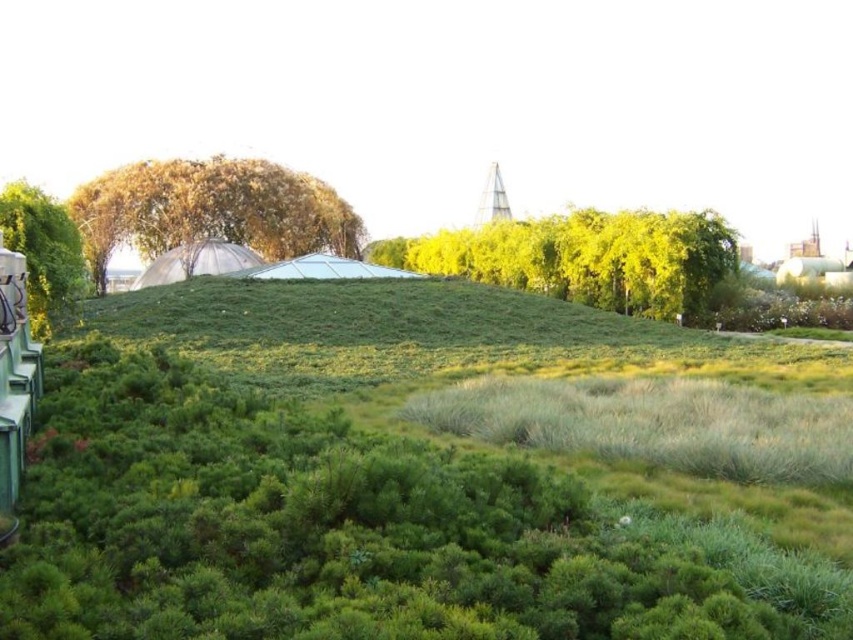
You are a gardener planning to prune the green leafy tree at center and the green leafy tree at left. Which tree requires a ladder to reach its branches?

The green leafy tree at center requires a ladder to reach its branches since it is much taller than the green leafy tree at left.

You are standing on the rooftop garden and want to take a photo of the green leafy tree at center. If your camera can focus on objects up to 30 meters away, will it be able to capture the tree clearly?

The green leafy tree at center is 30.13 meters away from the viewer. Since the camera can focus up to 30 meters, it cannot capture the tree clearly as it is slightly beyond the maximum range.